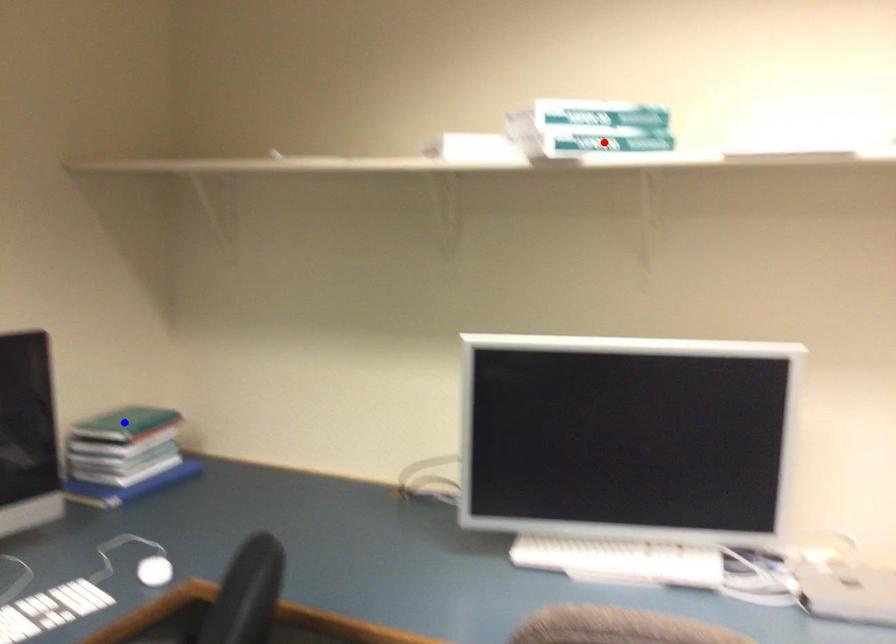
Question: In the image, two points are highlighted. Which point is nearer to the camera? Reply with the corresponding letter.

Choices:
 (A) blue point
 (B) red point

Answer: (B)